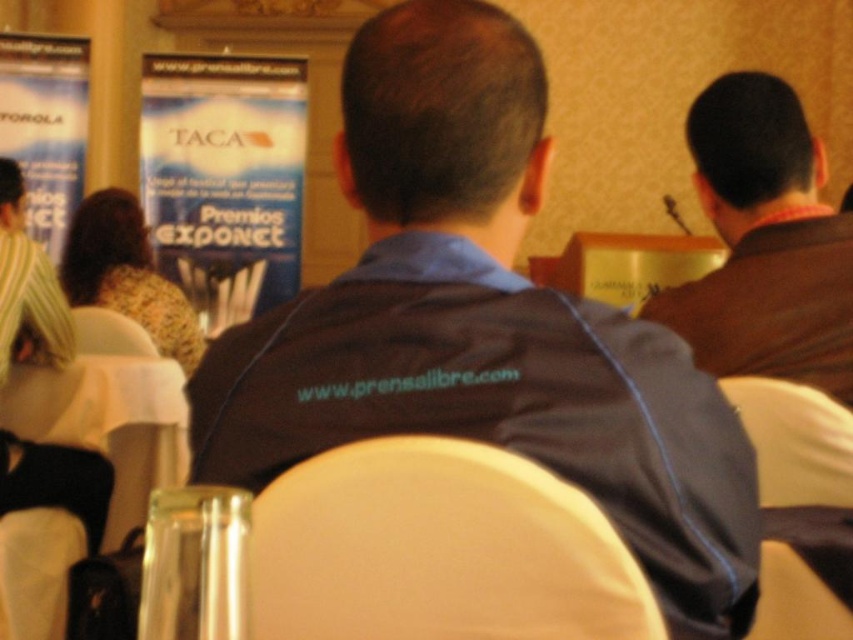
Who is shorter, blue paperboard poster at upper left or clear plastic bottle at lower left?

Standing shorter between the two is clear plastic bottle at lower left.

Can you confirm if blue paperboard poster at upper left is thinner than clear plastic bottle at lower left?

No, blue paperboard poster at upper left is not thinner than clear plastic bottle at lower left.

This screenshot has width=853, height=640. What do you see at coordinates (224, 179) in the screenshot?
I see `blue paperboard poster at upper left` at bounding box center [224, 179].

This screenshot has height=640, width=853. Find the location of `blue paperboard poster at upper left`. blue paperboard poster at upper left is located at coordinates (224, 179).

How much distance is there between white fabric chair at center and striped fabric shirt at left?

white fabric chair at center is 7.99 feet away from striped fabric shirt at left.

Is point (506, 634) more distant than point (4, 349)?

No, (506, 634) is closer to viewer.

The height and width of the screenshot is (640, 853). What are the coordinates of `white fabric chair at center` in the screenshot? It's located at (438, 550).

Can you confirm if white plastic chair at center is wider than white plastic chair at lower left?

In fact, white plastic chair at center might be narrower than white plastic chair at lower left.

Can you confirm if white plastic chair at center is positioned below white plastic chair at lower left?

Yes.

What do you see at coordinates (801, 472) in the screenshot?
I see `white plastic chair at center` at bounding box center [801, 472].

This screenshot has height=640, width=853. I want to click on white plastic chair at center, so click(x=801, y=472).